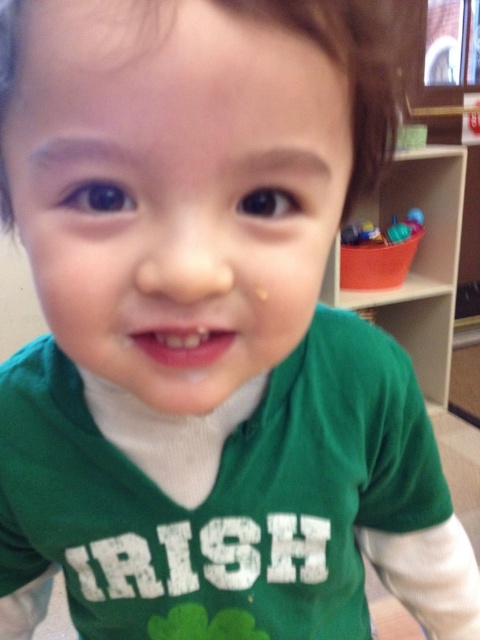
Based on the photo, you are a photographer setting up a shot of the child in the green shirt. The white wood bookshelf at upper right is in the background. To ensure the bookshelf is not in the frame, where should you position the camera relative to the child?

To avoid including the white wood bookshelf at upper right in the frame, position the camera to the left of the child, as the bookshelf is located at the upper right corner of the image at coordinates (416, 260).

Please look at the image of the child in the green shirt. There is a point at coordinates (416, 260). What object is located at this point?

The white wood bookshelf at upper right is located at point (416, 260).

You are standing in the room and want to pick up an object located at point (427, 268). If you are 1.65 meters tall, will you be able to reach it?

The point (427, 268) is 2.12 meters away from you. Since the average reaching distance for an adult is about 2 meters, you might need to take a step forward to reach it.